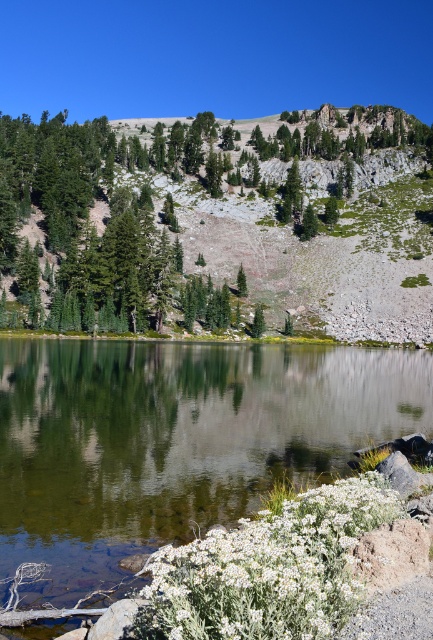
Based on the photo, does green reflective water at center come in front of green leafy trees at upper left?

Yes, it is in front of green leafy trees at upper left.

At what (x,y) coordinates should I click in order to perform the action: click on green reflective water at center. Please return your answer as a coordinate pair (x, y). The width and height of the screenshot is (433, 640). Looking at the image, I should click on (174, 442).

Is point (65, 579) positioned in front of point (116, 145)?

Yes, it is in front of point (116, 145).

Identify the location of green reflective water at center. point(174,442).

Find the location of a particular element. green reflective water at center is located at coordinates (174, 442).

Does green reflective water at center have a greater height compared to green matte tree at center?

Correct, green reflective water at center is much taller as green matte tree at center.

Is point (100, 497) positioned before point (238, 291)?

Yes, it is.

This screenshot has width=433, height=640. Identify the location of green reflective water at center. (174, 442).

Does green leafy trees at upper left appear on the left side of green matte tree at center?

Correct, you'll find green leafy trees at upper left to the left of green matte tree at center.

Does green leafy trees at upper left have a greater width compared to green matte tree at center?

Indeed, green leafy trees at upper left has a greater width compared to green matte tree at center.

Who is more distant from viewer, [312,129] or [241,288]?

Positioned behind is point [312,129].

This screenshot has width=433, height=640. I want to click on green leafy trees at upper left, so click(x=220, y=212).